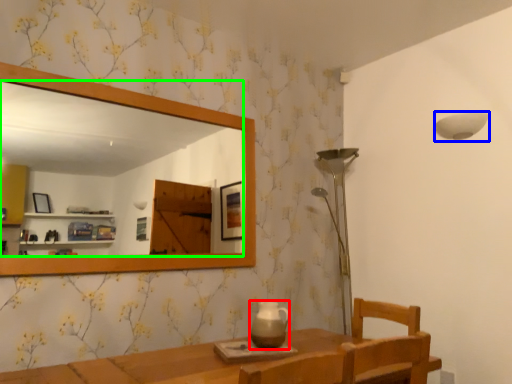
Question: Which object is positioned farthest from tea pot (highlighted by a red box)? Select from lamp (highlighted by a blue box) and mirror (highlighted by a green box).

Choices:
 (A) lamp
 (B) mirror

Answer: (B)